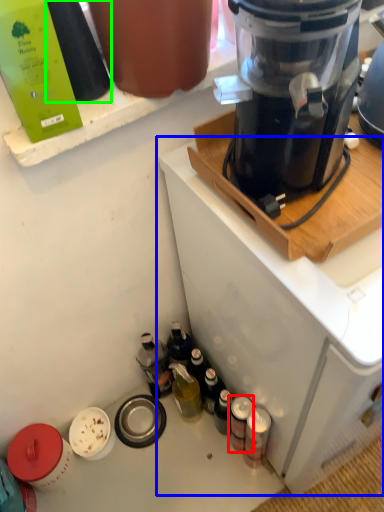
Question: Which object is positioned farthest from bottle (highlighted by a red box)? Select from home appliance (highlighted by a blue box) and bottle (highlighted by a green box).

Choices:
 (A) home appliance
 (B) bottle

Answer: (B)